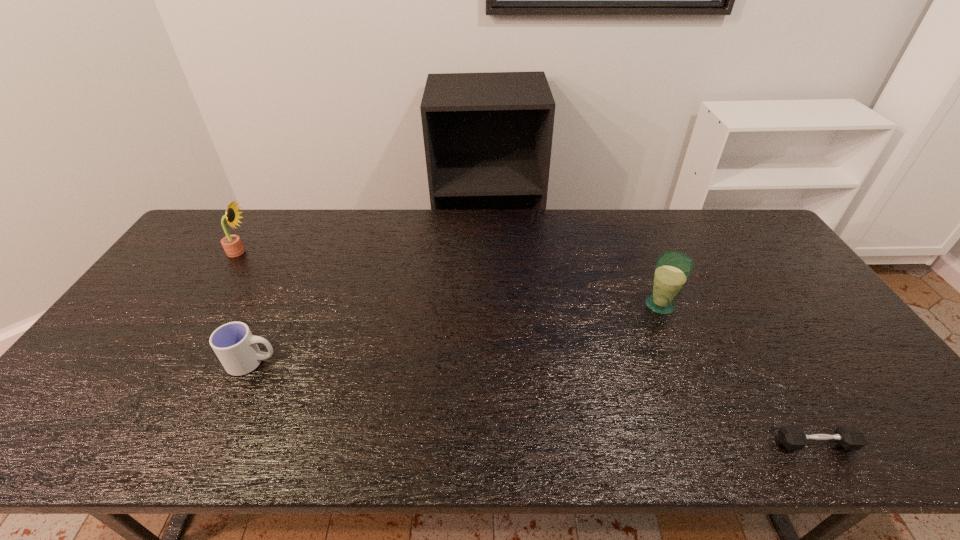
Find the location of a particular element. The width and height of the screenshot is (960, 540). vacant point located between the third nearest object and the sunflower is located at coordinates (449, 278).

The height and width of the screenshot is (540, 960). Identify the location of vacant point located between the second object from left to right and the third object from left to right. (456, 333).

Where is `free space between the second tallest object and the second object from left to right`? free space between the second tallest object and the second object from left to right is located at coordinates (456, 333).

This screenshot has width=960, height=540. Identify the location of unoccupied area between the third farthest object and the rightmost object. (534, 403).

This screenshot has height=540, width=960. Identify the location of vacant area that lies between the second object from right to left and the cup. (456, 333).

Identify the location of free space between the shortest object and the sunflower. (528, 348).

Locate an element on the screen. The width and height of the screenshot is (960, 540). free space between the farthest object and the third shortest object is located at coordinates (449, 278).

The width and height of the screenshot is (960, 540). Find the location of `free space between the leftmost object and the dumbbell`. free space between the leftmost object and the dumbbell is located at coordinates (528, 348).

You are a GUI agent. You are given a task and a screenshot of the screen. Output one action in this format:
    pyautogui.click(x=<x>, y=<y>)
    Task: Click on the vacant space that's between the leftmost object and the second object from left to right
    The width and height of the screenshot is (960, 540).
    Given the screenshot: What is the action you would take?
    pyautogui.click(x=246, y=307)

The image size is (960, 540). I want to click on free space between the shortest object and the farthest object, so click(528, 348).